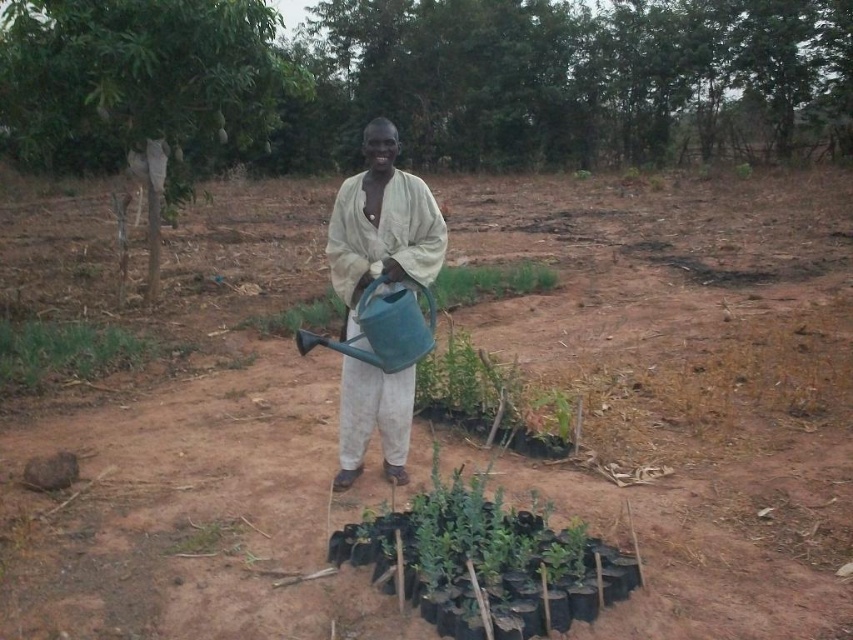
Is brown soil at center bigger than green leafy tree at upper left?

Actually, brown soil at center might be smaller than green leafy tree at upper left.

Identify the location of brown soil at center. (686, 381).

Does point (245, 467) lie behind point (173, 163)?

No, (245, 467) is closer to viewer.

Identify the location of brown soil at center. The width and height of the screenshot is (853, 640). (686, 381).

Does brown soil at center have a larger size compared to light beige fabric shirt at center?

Yes.

What do you see at coordinates (686, 381) in the screenshot? Image resolution: width=853 pixels, height=640 pixels. I see `brown soil at center` at bounding box center [686, 381].

Where is `brown soil at center`? The width and height of the screenshot is (853, 640). brown soil at center is located at coordinates (686, 381).

What do you see at coordinates (142, 86) in the screenshot? Image resolution: width=853 pixels, height=640 pixels. I see `green leafy tree at upper left` at bounding box center [142, 86].

Which of these two, green leafy tree at upper left or light beige fabric shirt at center, stands shorter?

light beige fabric shirt at center

Which is behind, point (228, 28) or point (396, 273)?

Positioned behind is point (228, 28).

I want to click on green leafy tree at upper left, so click(142, 86).